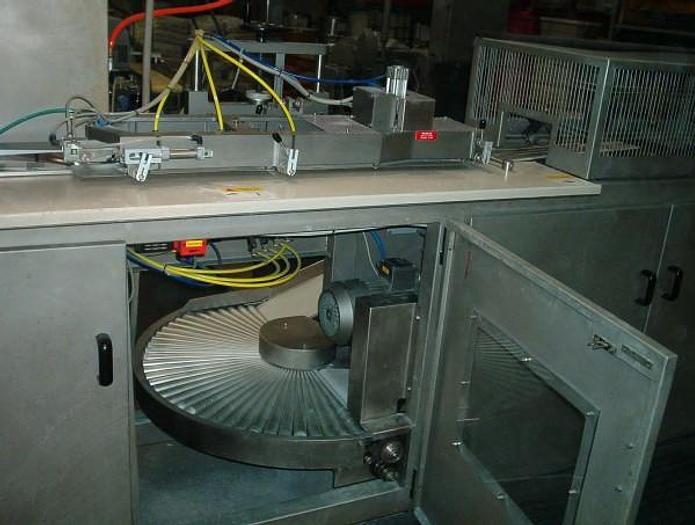
You are a GUI agent. You are given a task and a screenshot of the screen. Output one action in this format:
    pyautogui.click(x=<x>, y=<y>)
    Task: Click on the window
    
    Given the screenshot: What is the action you would take?
    (x=527, y=427)